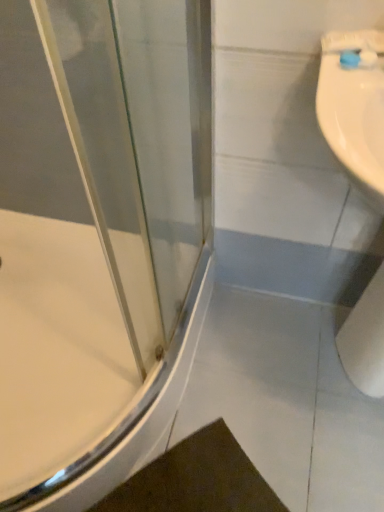
Question: Looking at their shapes, would you say blue plastic toothbrush at upper right is wider or thinner than white matte toilet paper at lower right?

Choices:
 (A) thin
 (B) wide

Answer: (A)

Question: Looking at the image, does blue plastic toothbrush at upper right seem bigger or smaller compared to white matte toilet paper at lower right?

Choices:
 (A) big
 (B) small

Answer: (B)

Question: Which object is positioned closest to the white glossy bathtub at left?

Choices:
 (A) white matte toilet paper at lower right
 (B) blue plastic toothbrush at upper right

Answer: (A)

Question: Based on their relative distances, which object is nearer to the white glossy bathtub at left?

Choices:
 (A) white matte toilet paper at lower right
 (B) blue plastic toothbrush at upper right

Answer: (A)